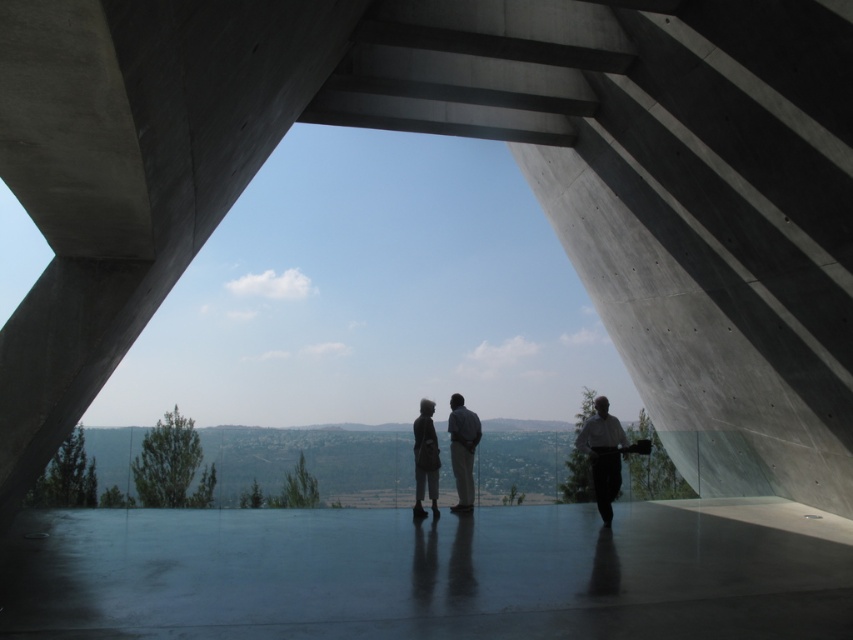
Question: Does white shirt at right appear on the right side of dark gray fabric bag at center?

Choices:
 (A) no
 (B) yes

Answer: (B)

Question: Based on their relative distances, which object is nearer to the dark gray fabric bag at center?

Choices:
 (A) dark gray suit at center
 (B) white shirt at right

Answer: (A)

Question: Does white shirt at right have a smaller size compared to dark gray suit at center?

Choices:
 (A) yes
 (B) no

Answer: (B)

Question: Among these objects, which one is farthest from the camera?

Choices:
 (A) smooth concrete floor at center
 (B) dark gray suit at center

Answer: (B)

Question: Can you confirm if smooth concrete floor at center is thinner than dark gray fabric bag at center?

Choices:
 (A) no
 (B) yes

Answer: (A)

Question: Which object is closer to the camera taking this photo?

Choices:
 (A) dark gray suit at center
 (B) dark gray fabric bag at center
 (C) smooth concrete floor at center

Answer: (C)